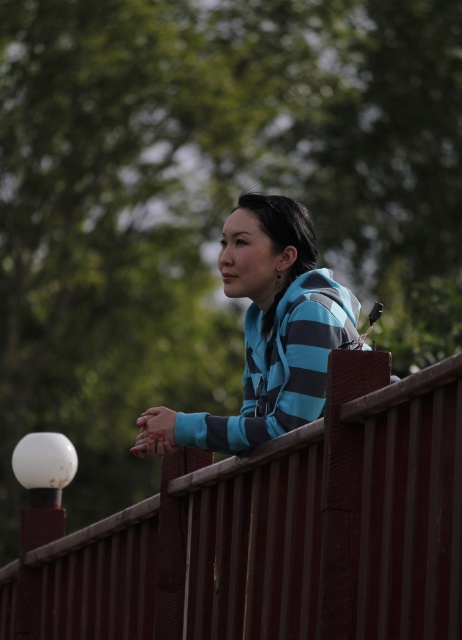
Question: Which object is closer to the camera taking this photo?

Choices:
 (A) rustic wood fence at center
 (B) blue striped hoodie at center

Answer: (A)

Question: Is the position of rustic wood fence at center more distant than that of blue striped hoodie at center?

Choices:
 (A) yes
 (B) no

Answer: (B)

Question: Which of the following is the farthest from the observer?

Choices:
 (A) (297, 298)
 (B) (402, 576)

Answer: (A)

Question: Does rustic wood fence at center appear over blue striped hoodie at center?

Choices:
 (A) no
 (B) yes

Answer: (A)

Question: Which point appears closest to the camera in this image?

Choices:
 (A) (238, 509)
 (B) (219, 433)

Answer: (A)

Question: Can you confirm if rustic wood fence at center is positioned to the right of blue striped hoodie at center?

Choices:
 (A) yes
 (B) no

Answer: (B)